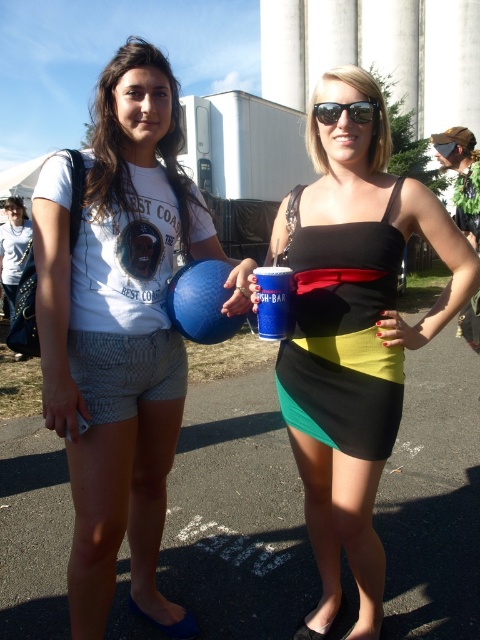
Can you confirm if white cotton t-shirt at upper left is wider than blue rubber balloon at center?

Correct, the width of white cotton t-shirt at upper left exceeds that of blue rubber balloon at center.

Between white cotton t-shirt at upper left and blue rubber balloon at center, which one has less height?

blue rubber balloon at center

Is point (111, 156) closer to viewer compared to point (206, 266)?

Yes.

Identify the location of white cotton t-shirt at upper left. Image resolution: width=480 pixels, height=640 pixels. (129, 138).

Who is higher up, matte white t-shirt at left or black matte dress at center?

Positioned higher is matte white t-shirt at left.

Is matte white t-shirt at left below black matte dress at center?

Incorrect, matte white t-shirt at left is not positioned below black matte dress at center.

Describe the element at coordinates (120, 330) in the screenshot. I see `matte white t-shirt at left` at that location.

The height and width of the screenshot is (640, 480). I want to click on matte white t-shirt at left, so click(x=120, y=330).

Is matte black dress at center bigger than white cotton t-shirt at upper left?

No, matte black dress at center is not bigger than white cotton t-shirt at upper left.

Does point (384, 291) lie in front of point (164, 147)?

Yes, point (384, 291) is closer to viewer.

This screenshot has width=480, height=640. Identify the location of matte black dress at center. click(x=352, y=333).